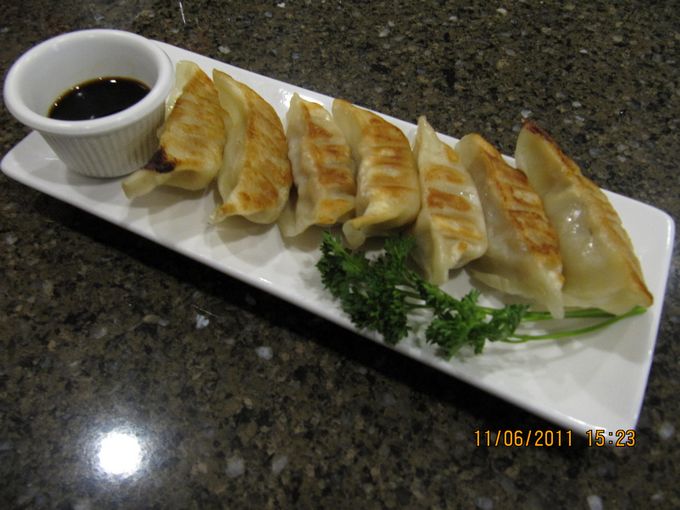
This screenshot has height=510, width=680. In order to click on plate in this screenshot , I will do `click(272, 270)`.